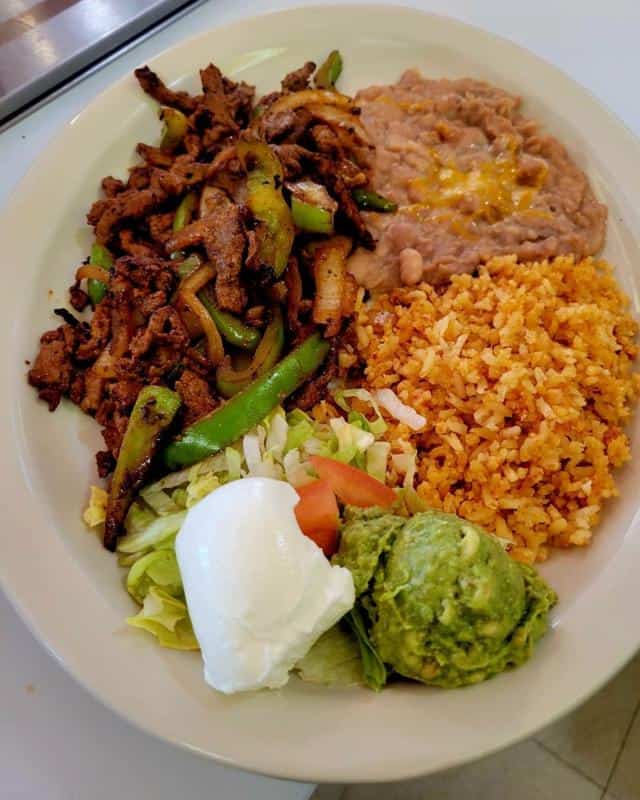
This screenshot has width=640, height=800. In order to click on white surface in this screenshot , I will do `click(86, 746)`.